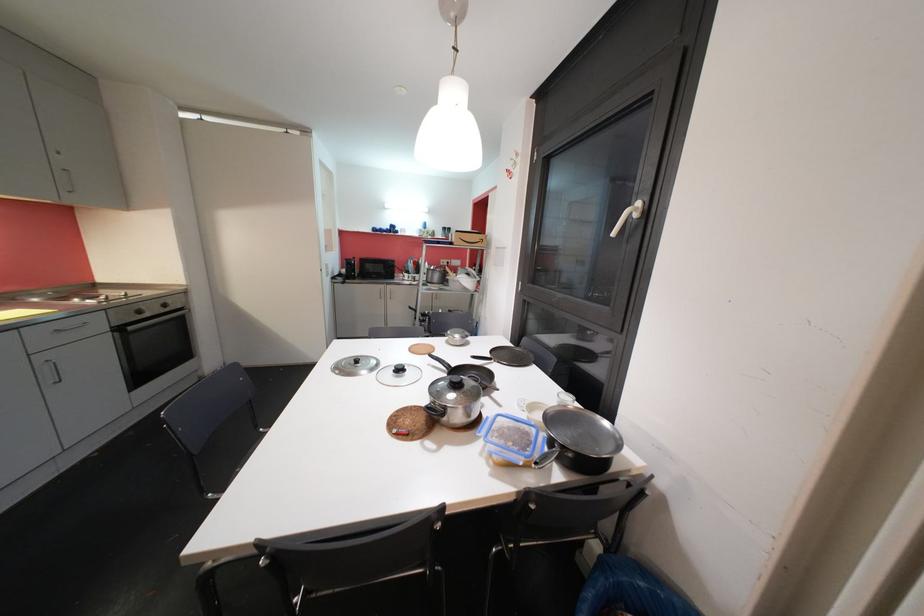
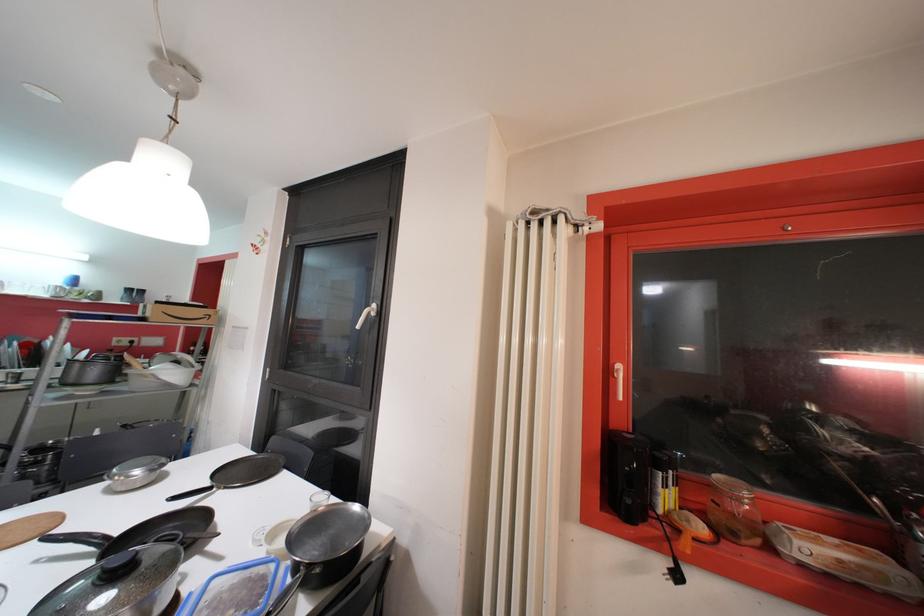
Where in the second image is the point corresponding to [463,339] from the first image?

(142, 474)